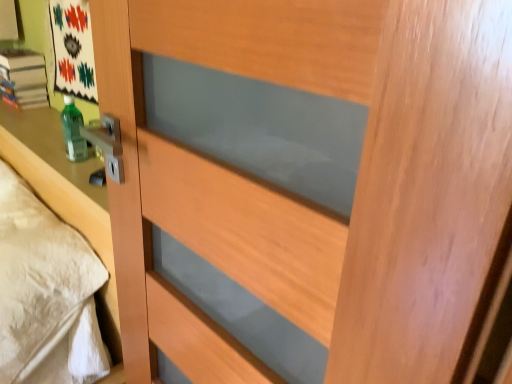
What is the approximate width of beige fabric bed at left?

beige fabric bed at left is 16.69 inches in width.

The height and width of the screenshot is (384, 512). What do you see at coordinates (46, 293) in the screenshot? I see `beige fabric bed at left` at bounding box center [46, 293].

What is the approximate height of beige fabric bed at left?

The height of beige fabric bed at left is 23.48 inches.

At what (x,y) coordinates should I click in order to perform the action: click on beige fabric bed at left. Please return your answer as a coordinate pair (x, y). This screenshot has width=512, height=384. Looking at the image, I should click on (46, 293).

This screenshot has width=512, height=384. Identify the location of beige fabric bed at left. (46, 293).